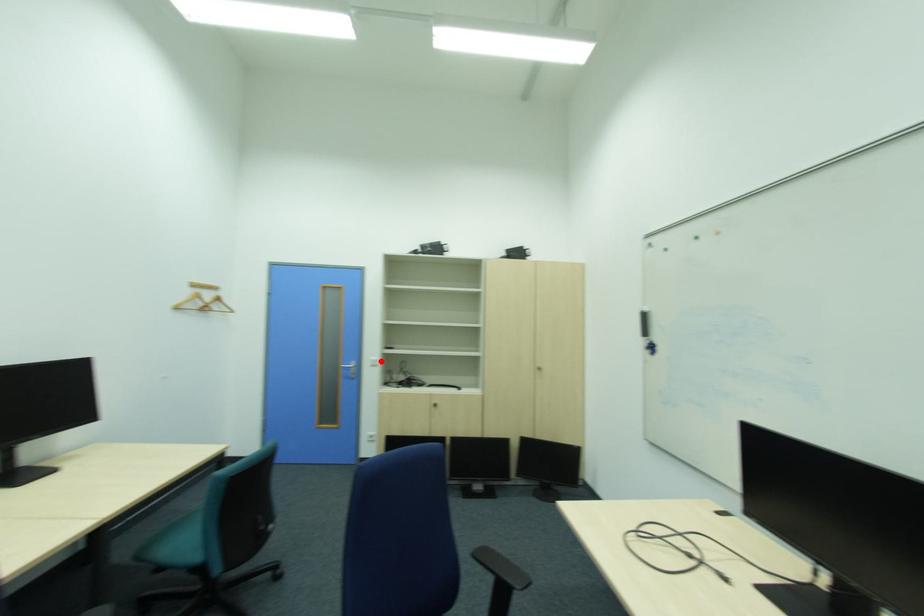
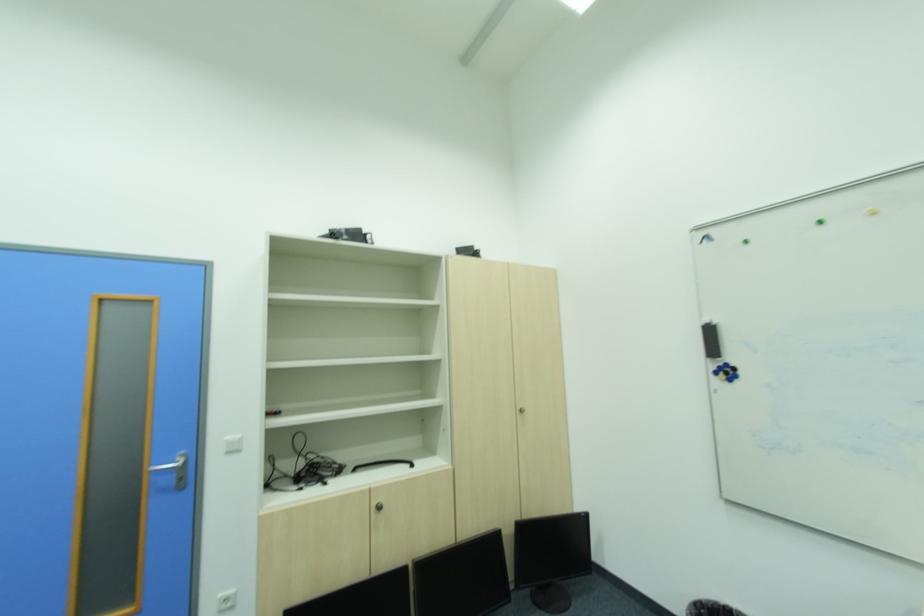
The point at the highlighted location is marked in the first image. Where is the corresponding point in the second image?

(237, 443)